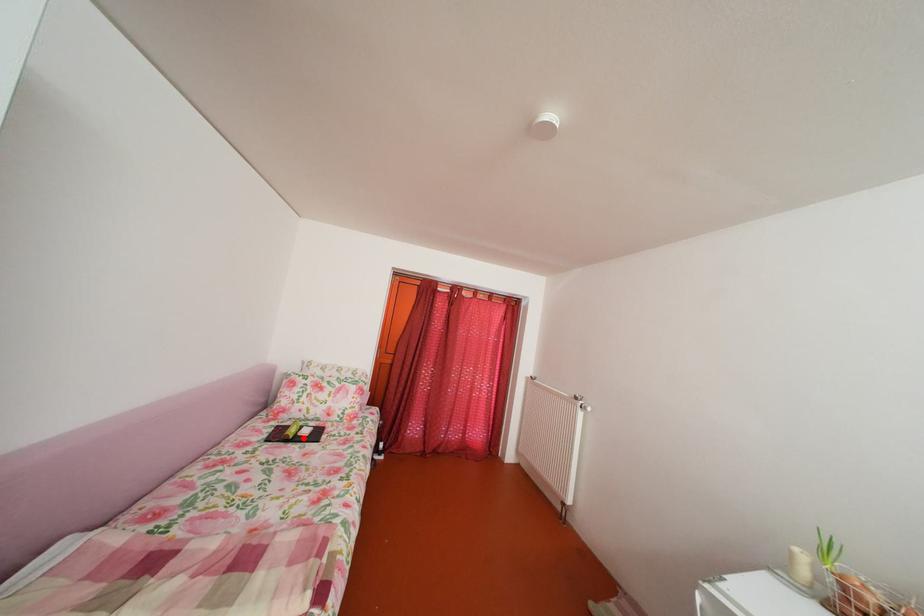
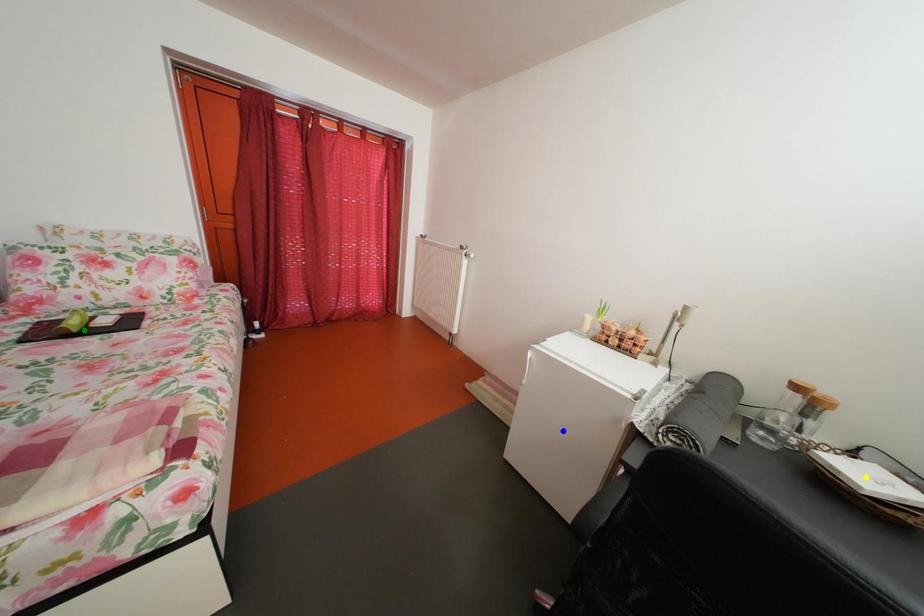
Question: I am providing you with two images of the same scene from different viewpoints. A red point is marked on the first image. You are given multiple points on the second image. Which point in image 2 represents the same 3d spot as the red point in image 1?

Choices:
 (A) green point
 (B) yellow point
 (C) blue point

Answer: (A)